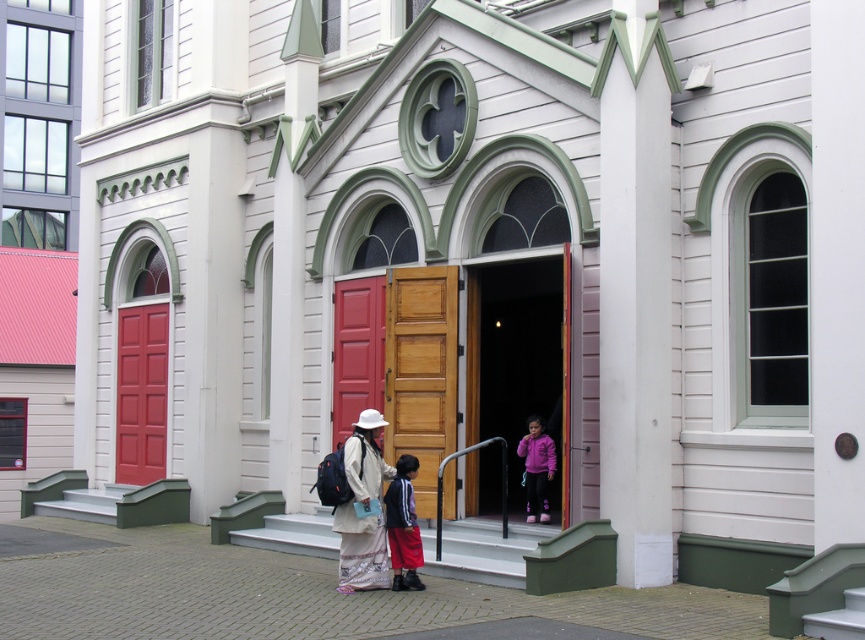
You are standing at the main entrance of the building and want to move towards the point marked at coordinates point [351,387]. However, there is an obstacle at point [340,580]. Based on the spatial relationship between these two points, will you be able to reach your destination without going around the obstacle?

Since point [351,387] is behind point [340,580], you will need to go around the obstacle at point [340,580] to reach your destination.

You are a visitor at the building and see the matte red door at center and the matte white hat at center. Which object is closer to you?

The matte red door at center is closer to you because the matte white hat at center is behind it.

You are a parent trying to reach your child who is standing at the pink matte jacket at center near the entrance of the building. The smooth concrete stairs at center lead to the exit. Can you safely carry your child down the stairs if the child is currently 1.63 meters away from the stairs?

The distance between the smooth concrete stairs at center and the pink matte jacket at center is 1.63 meters. Since the child is only 1.63 meters away from the stairs, you can safely carry them down the stairs as they are within a reachable distance.